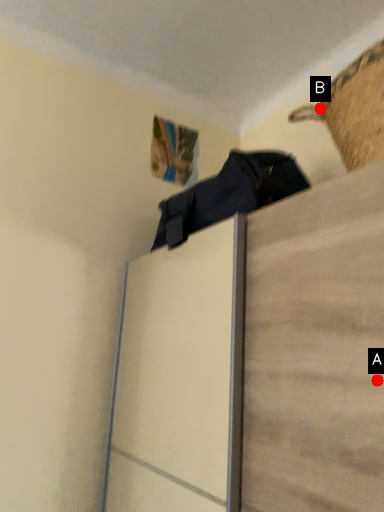
Question: Two points are circled on the image, labeled by A and B beside each circle. Which point is farther to the camera?

Choices:
 (A) A is further
 (B) B is further

Answer: (B)